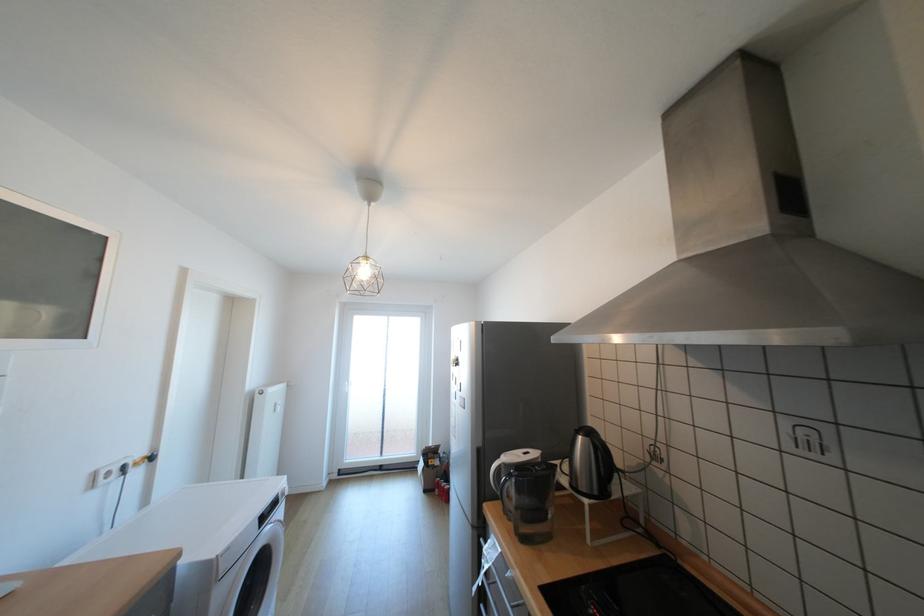
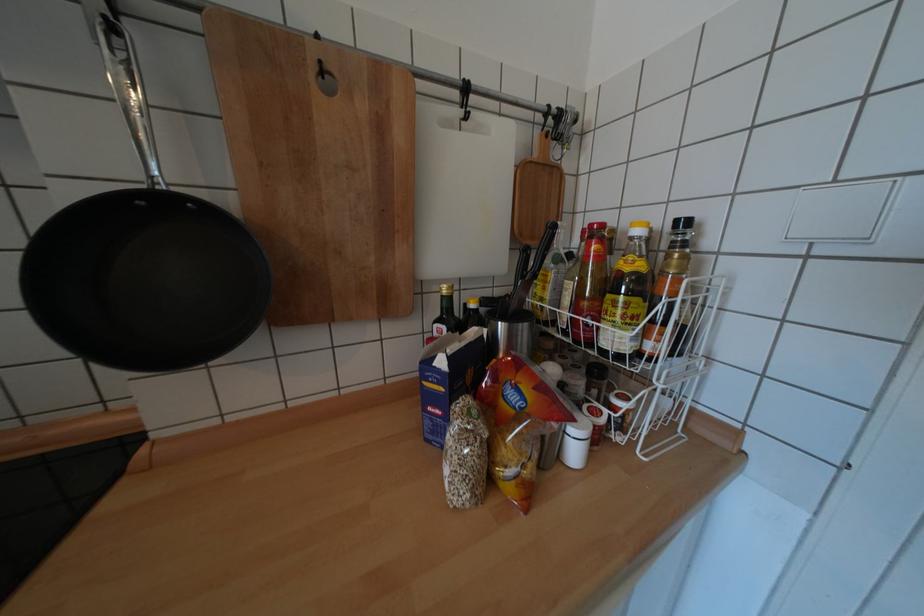
Question: The first image is from the beginning of the video and the second image is from the end. How did the camera likely rotate when shooting the video?

Choices:
 (A) Left
 (B) Right
 (C) Up
 (D) Down

Answer: (B)